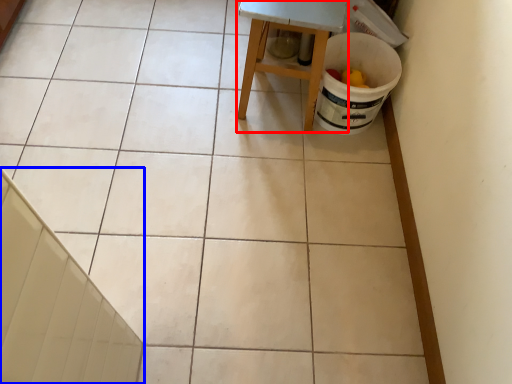
Question: Which of the following is the farthest to the observer, furniture (highlighted by a red box) or stair (highlighted by a blue box)?

Choices:
 (A) furniture
 (B) stair

Answer: (A)